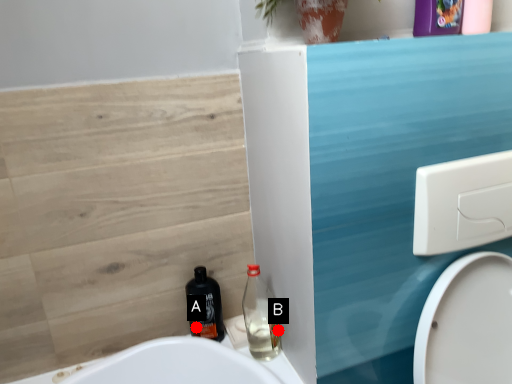
Question: Two points are circled on the image, labeled by A and B beside each circle. Which point is closer to the camera taking this photo?

Choices:
 (A) A is closer
 (B) B is closer

Answer: (B)